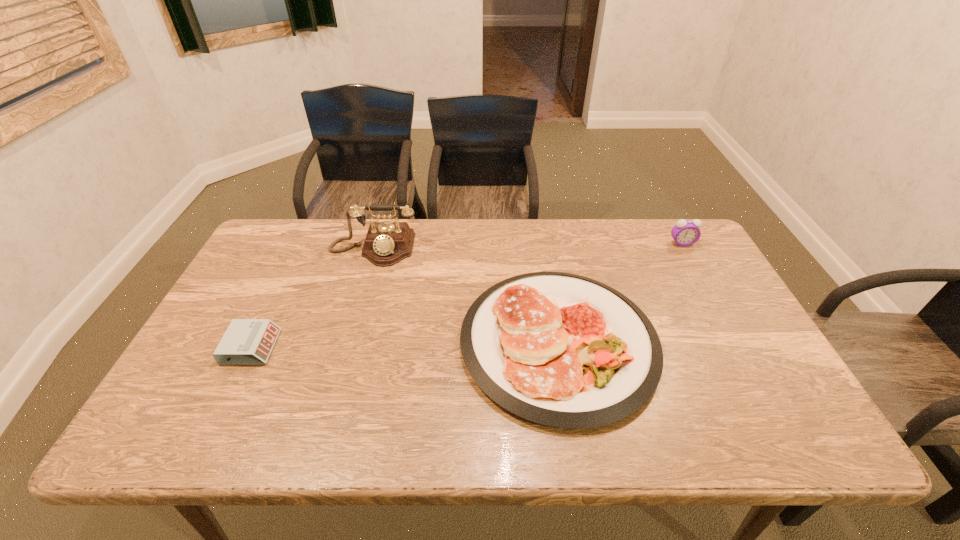
You are a GUI agent. You are given a task and a screenshot of the screen. Output one action in this format:
    pyautogui.click(x=<x>, y=<y>)
    Task: Click on the free space located on the right of the second shortest object
    Image resolution: width=960 pixels, height=540 pixels.
    Given the screenshot: What is the action you would take?
    pyautogui.click(x=708, y=342)

Locate an element on the screen. free space located 0.180m on the front of the nearer alarm clock is located at coordinates (209, 433).

This screenshot has width=960, height=540. Identify the location of telephone present at the far edge. (387, 243).

Find the location of `alarm clock positioned at the far edge`. alarm clock positioned at the far edge is located at coordinates (686, 232).

What are the coordinates of `object positioned at the near edge` in the screenshot? It's located at (558, 349).

The width and height of the screenshot is (960, 540). I want to click on object that is at the left edge, so click(246, 341).

Where is `object that is at the right edge`? object that is at the right edge is located at coordinates (686, 232).

At what (x,y) coordinates should I click in order to perform the action: click on object at the far right corner. Please return your answer as a coordinate pair (x, y). The width and height of the screenshot is (960, 540). Looking at the image, I should click on (686, 232).

In the image, there is a desktop. Where is `vacant region at the far edge`? vacant region at the far edge is located at coordinates (589, 225).

This screenshot has width=960, height=540. Find the location of `vacant space at the near edge`. vacant space at the near edge is located at coordinates (413, 430).